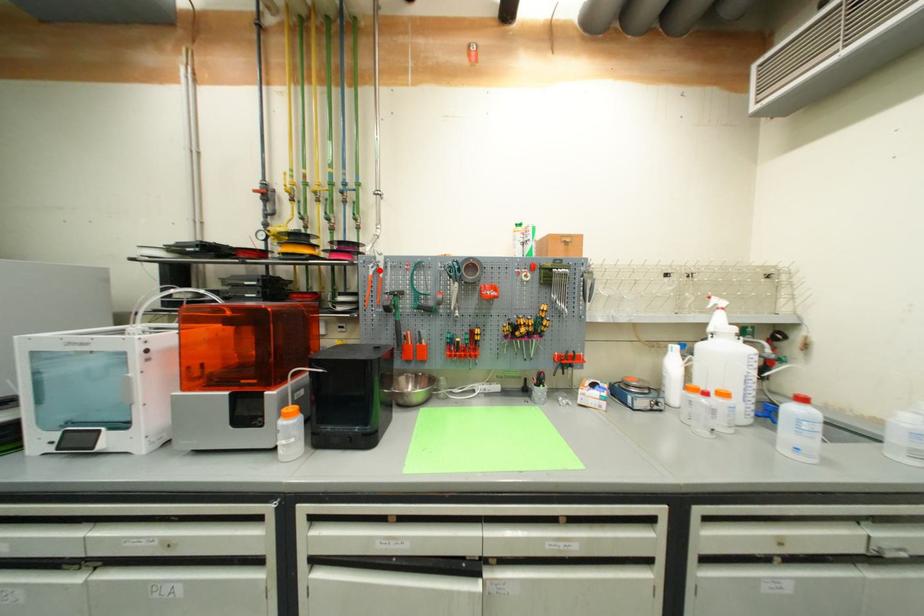
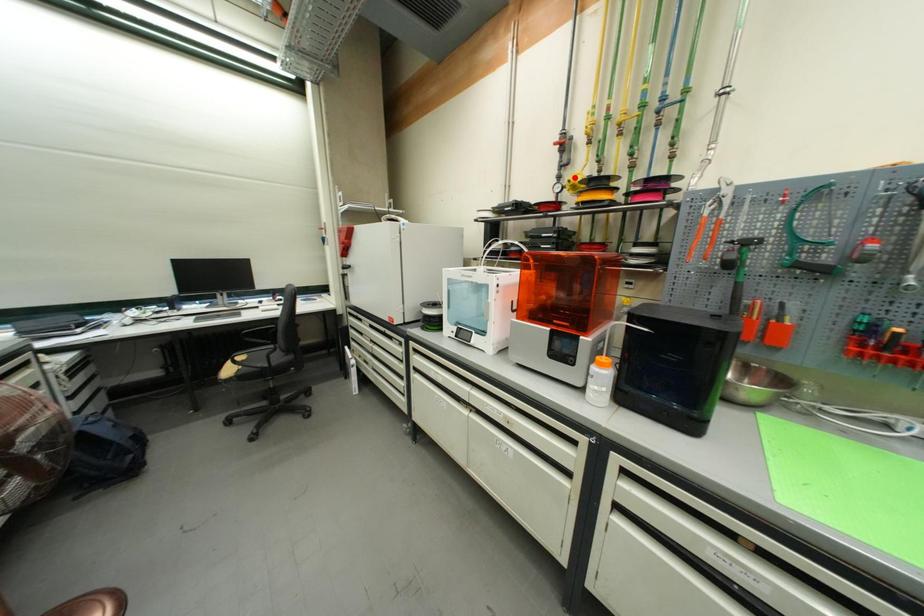
I am providing you with two images of the same scene from different viewpoints. A red point is marked on the first image and another point is marked on the second image. Do the highlighted points in image1 and image2 indicate the same real-world spot?

No